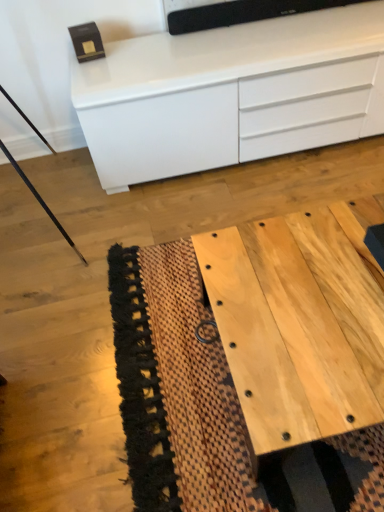
Question: Is natural wood table at lower right aimed at white glossy chest of drawers at upper center?

Choices:
 (A) yes
 (B) no

Answer: (B)

Question: Does natural wood table at lower right have a greater height compared to white glossy chest of drawers at upper center?

Choices:
 (A) no
 (B) yes

Answer: (A)

Question: Would you say natural wood table at lower right is outside white glossy chest of drawers at upper center?

Choices:
 (A) no
 (B) yes

Answer: (B)

Question: Does natural wood table at lower right have a smaller size compared to white glossy chest of drawers at upper center?

Choices:
 (A) no
 (B) yes

Answer: (B)

Question: From the image's perspective, is natural wood table at lower right located above white glossy chest of drawers at upper center?

Choices:
 (A) yes
 (B) no

Answer: (B)

Question: Does natural wood table at lower right have a greater width compared to white glossy chest of drawers at upper center?

Choices:
 (A) no
 (B) yes

Answer: (B)

Question: Is white glossy chest of drawers at upper center positioned far away from natural wood table at lower right?

Choices:
 (A) no
 (B) yes

Answer: (A)

Question: Is white glossy chest of drawers at upper center closer to camera compared to natural wood table at lower right?

Choices:
 (A) yes
 (B) no

Answer: (B)

Question: Can you confirm if white glossy chest of drawers at upper center is thinner than natural wood table at lower right?

Choices:
 (A) yes
 (B) no

Answer: (A)

Question: From a real-world perspective, is white glossy chest of drawers at upper center positioned under natural wood table at lower right based on gravity?

Choices:
 (A) yes
 (B) no

Answer: (B)

Question: Is white glossy chest of drawers at upper center touching natural wood table at lower right?

Choices:
 (A) no
 (B) yes

Answer: (A)

Question: Is white glossy chest of drawers at upper center located outside natural wood table at lower right?

Choices:
 (A) no
 (B) yes

Answer: (B)

Question: Does point (253, 118) appear closer or farther from the camera than point (375, 412)?

Choices:
 (A) closer
 (B) farther

Answer: (B)